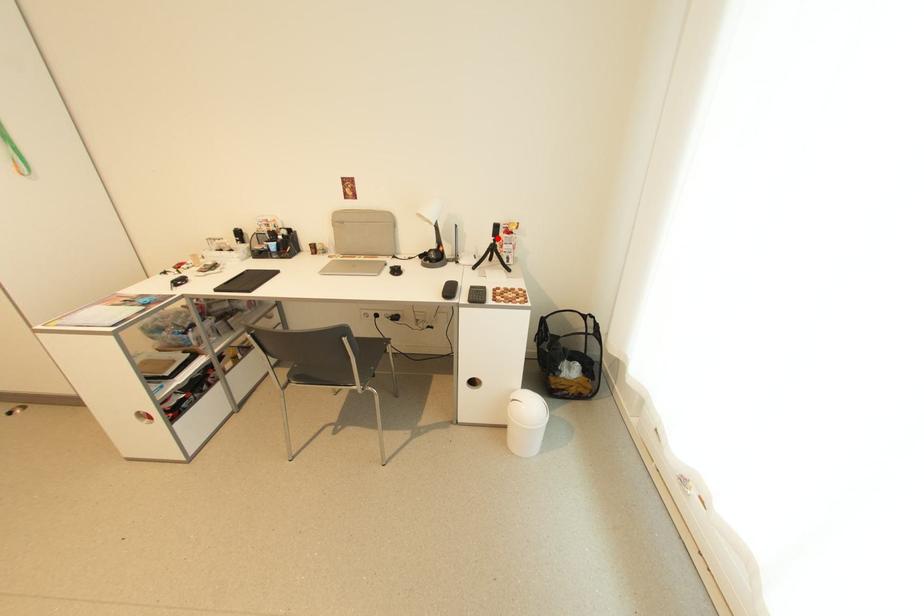
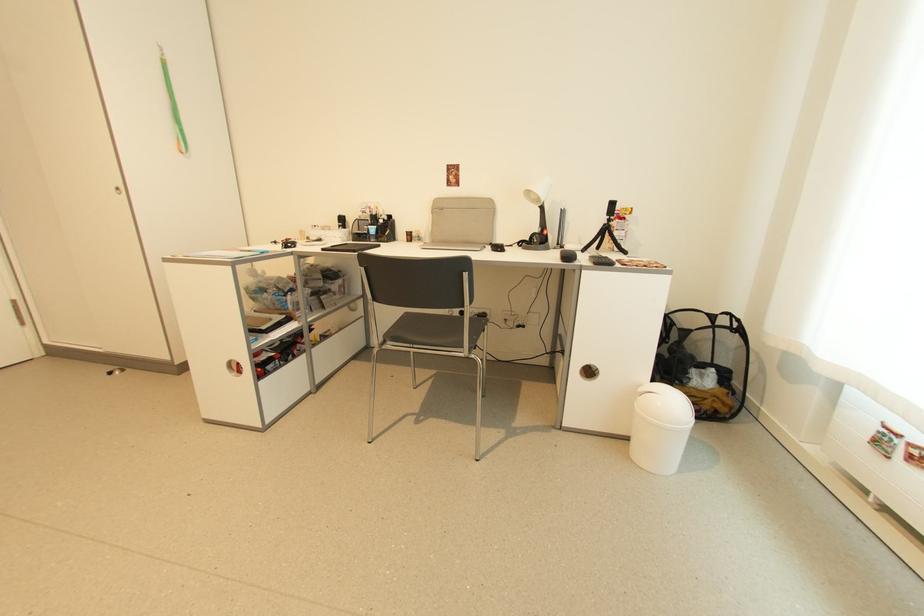
The point at the highlighted location is marked in the first image. Where is the corresponding point in the second image?

(612, 217)